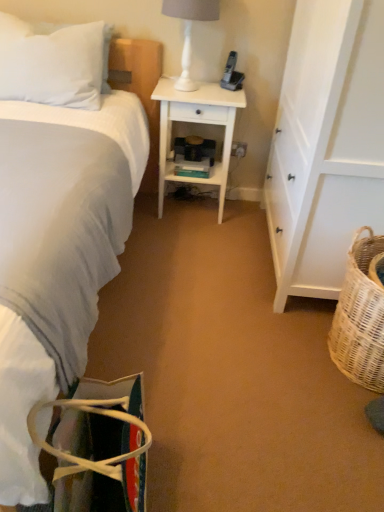
Question: Could white wood desk at center be considered to be inside white soft pillow at upper left?

Choices:
 (A) no
 (B) yes

Answer: (A)

Question: From a real-world perspective, does white soft pillow at upper left stand above white wood desk at center?

Choices:
 (A) no
 (B) yes

Answer: (B)

Question: Is white soft pillow at upper left wider than white wood desk at center?

Choices:
 (A) yes
 (B) no

Answer: (B)

Question: Can you confirm if white soft pillow at upper left is positioned to the left of white wood desk at center?

Choices:
 (A) no
 (B) yes

Answer: (B)

Question: Can you confirm if white soft pillow at upper left is shorter than white wood desk at center?

Choices:
 (A) yes
 (B) no

Answer: (A)

Question: Would you say white soft bed at left is to the left or to the right of multicolored fabric bag at lower left in the picture?

Choices:
 (A) left
 (B) right

Answer: (A)

Question: Is white soft bed at left bigger or smaller than multicolored fabric bag at lower left?

Choices:
 (A) small
 (B) big

Answer: (B)

Question: Is point (6, 18) positioned closer to the camera than point (117, 434)?

Choices:
 (A) closer
 (B) farther

Answer: (B)

Question: Is white soft bed at left in front of or behind multicolored fabric bag at lower left in the image?

Choices:
 (A) behind
 (B) front

Answer: (B)

Question: Would you say white glossy lamp at upper center is inside or outside white plastic electric outlet at center?

Choices:
 (A) outside
 (B) inside

Answer: (A)

Question: Is white glossy lamp at upper center wider or thinner than white plastic electric outlet at center?

Choices:
 (A) wide
 (B) thin

Answer: (A)

Question: Does point (190, 39) appear closer or farther from the camera than point (233, 147)?

Choices:
 (A) farther
 (B) closer

Answer: (B)

Question: Would you say white glossy lamp at upper center is to the left or to the right of white plastic electric outlet at center in the picture?

Choices:
 (A) right
 (B) left

Answer: (B)

Question: Would you say white wood desk at center is inside or outside black plastic phone at upper center?

Choices:
 (A) outside
 (B) inside

Answer: (A)

Question: Does point pyautogui.click(x=223, y=130) appear closer or farther from the camera than point pyautogui.click(x=230, y=84)?

Choices:
 (A) closer
 (B) farther

Answer: (A)